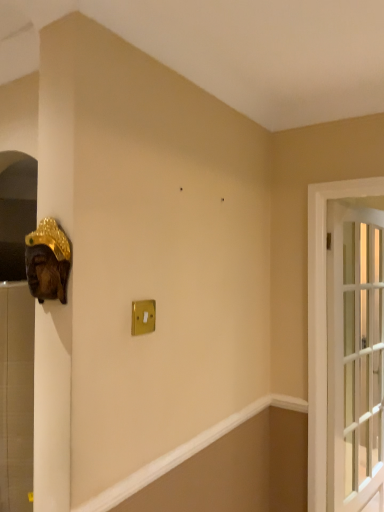
Where is `clear glass door at right`? The image size is (384, 512). clear glass door at right is located at coordinates (355, 355).

Locate an element on the screen. clear glass door at right is located at coordinates (355, 355).

Which object is positioned more to the right, clear glass door at right or wooden mask at left?

clear glass door at right is more to the right.

Can you tell me how much clear glass door at right and wooden mask at left differ in facing direction?

The facing directions of clear glass door at right and wooden mask at left are 1.18 degrees apart.

Is clear glass door at right not inside wooden mask at left?

Absolutely, clear glass door at right is external to wooden mask at left.

Is clear glass door at right touching wooden mask at left?

No, clear glass door at right is not making contact with wooden mask at left.

Which of these two, wooden mask at left or clear glass door at right, is smaller?

Smaller between the two is wooden mask at left.

Considering their positions, is wooden mask at left located in front of or behind clear glass door at right?

wooden mask at left is positioned closer to the viewer than clear glass door at right.

Does wooden mask at left turn towards clear glass door at right?

No, wooden mask at left is not facing towards clear glass door at right.

From the image's perspective, is wooden mask at left located above or below clear glass door at right?

wooden mask at left is situated higher than clear glass door at right in the image.

Is clear glass door at right turned away from gold metallic light switch at center?

No, clear glass door at right is not facing the opposite direction of gold metallic light switch at center.

Can you confirm if clear glass door at right is shorter than gold metallic light switch at center?

In fact, clear glass door at right may be taller than gold metallic light switch at center.

Is clear glass door at right placed right next to gold metallic light switch at center?

clear glass door at right and gold metallic light switch at center are not in contact.

Does gold metallic light switch at center have a lesser height compared to wooden mask at left?

Indeed, gold metallic light switch at center has a lesser height compared to wooden mask at left.

In the scene shown: Which object is positioned more to the left, gold metallic light switch at center or wooden mask at left?

wooden mask at left is more to the left.

Which object is wider, gold metallic light switch at center or wooden mask at left?

Wider between the two is wooden mask at left.

This screenshot has width=384, height=512. What are the coordinates of `light switch directly beneath the wooden mask at left (from a real-world perspective)` in the screenshot? It's located at (143, 317).

Considering the relative sizes of wooden mask at left and gold metallic light switch at center in the image provided, is wooden mask at left shorter than gold metallic light switch at center?

In fact, wooden mask at left may be taller than gold metallic light switch at center.

Is wooden mask at left placed right next to gold metallic light switch at center?

No, wooden mask at left is not next to gold metallic light switch at center.

Considering the relative sizes of gold metallic light switch at center and clear glass door at right in the image provided, is gold metallic light switch at center shorter than clear glass door at right?

Yes, gold metallic light switch at center is shorter than clear glass door at right.

Choose the correct answer: Is gold metallic light switch at center inside clear glass door at right or outside it?

gold metallic light switch at center is outside clear glass door at right.

In the image, there is a clear glass door at right. Identify the location of light switch above it (from the image's perspective). (143, 317).

Which is farther, (137,312) or (336,342)?

The point (336,342) is farther from the camera.

At what (x,y) coordinates should I click in order to perform the action: click on window behind the wooden mask at left. Please return your answer as a coordinate pair (x, y). The width and height of the screenshot is (384, 512). Looking at the image, I should click on (355, 355).

You are a GUI agent. You are given a task and a screenshot of the screen. Output one action in this format:
    pyautogui.click(x=<x>, y=<y>)
    Task: Click on the sculpture lying above the clear glass door at right (from the image's perspective)
    The width and height of the screenshot is (384, 512).
    Given the screenshot: What is the action you would take?
    (x=48, y=261)

Based on the photo, when comparing their distances from wooden mask at left, does clear glass door at right or gold metallic light switch at center seem further?

The object further to wooden mask at left is clear glass door at right.

Based on the photo, based on their spatial positions, is gold metallic light switch at center or clear glass door at right closer to wooden mask at left?

Based on the image, gold metallic light switch at center appears to be nearer to wooden mask at left.

From the picture: Based on their spatial positions, is clear glass door at right or wooden mask at left closer to gold metallic light switch at center?

Among the two, wooden mask at left is located nearer to gold metallic light switch at center.

When comparing their distances from gold metallic light switch at center, does wooden mask at left or clear glass door at right seem further?

Among the two, clear glass door at right is located further to gold metallic light switch at center.

In the scene shown: Based on their spatial positions, is gold metallic light switch at center or wooden mask at left further from clear glass door at right?

Among the two, wooden mask at left is located further to clear glass door at right.

Considering their positions, is wooden mask at left positioned closer to clear glass door at right than gold metallic light switch at center?

gold metallic light switch at center is closer to clear glass door at right.

Where is `light switch situated between wooden mask at left and clear glass door at right from left to right`? This screenshot has width=384, height=512. light switch situated between wooden mask at left and clear glass door at right from left to right is located at coordinates (143, 317).